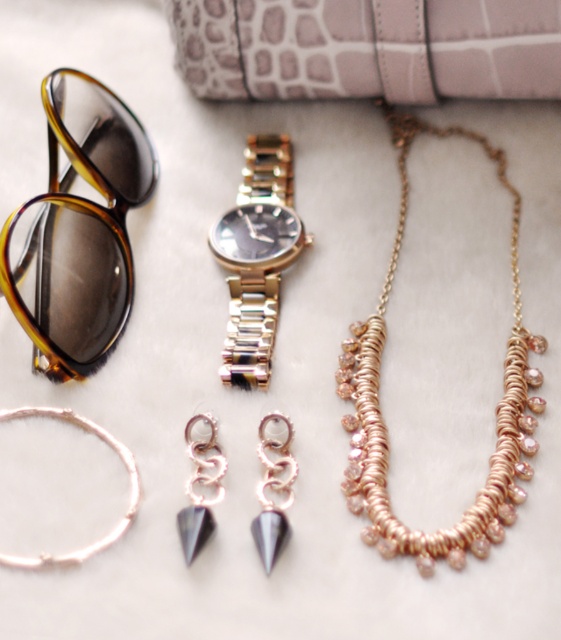
Can you confirm if tortoiseshell acetate sunglasses at upper left is smaller than rose gold wire necklace at center?

Yes, tortoiseshell acetate sunglasses at upper left is smaller than rose gold wire necklace at center.

Is tortoiseshell acetate sunglasses at upper left further to the viewer compared to rose gold wire necklace at center?

Yes, tortoiseshell acetate sunglasses at upper left is behind rose gold wire necklace at center.

Describe the element at coordinates (77, 228) in the screenshot. I see `tortoiseshell acetate sunglasses at upper left` at that location.

The image size is (561, 640). I want to click on tortoiseshell acetate sunglasses at upper left, so click(x=77, y=228).

Can you confirm if rose gold wire necklace at center is positioned below silver metallic spike earrings at center?

Incorrect, rose gold wire necklace at center is not positioned below silver metallic spike earrings at center.

How far apart are rose gold wire necklace at center and silver metallic spike earrings at center?

rose gold wire necklace at center and silver metallic spike earrings at center are 8.31 inches apart from each other.

Who is more distant from viewer, [486,484] or [274,449]?

The point [274,449] is more distant.

Where is `rose gold wire necklace at center`? This screenshot has width=561, height=640. rose gold wire necklace at center is located at coordinates click(385, 428).

This screenshot has height=640, width=561. What are the coordinates of `gold metallic watch at center` in the screenshot? It's located at (256, 257).

Is gold metallic watch at center smaller than silver metallic spike earrings at center?

No, gold metallic watch at center is not smaller than silver metallic spike earrings at center.

Is point (228, 221) positioned before point (278, 436)?

No, (228, 221) is behind (278, 436).

The image size is (561, 640). I want to click on gold metallic watch at center, so click(256, 257).